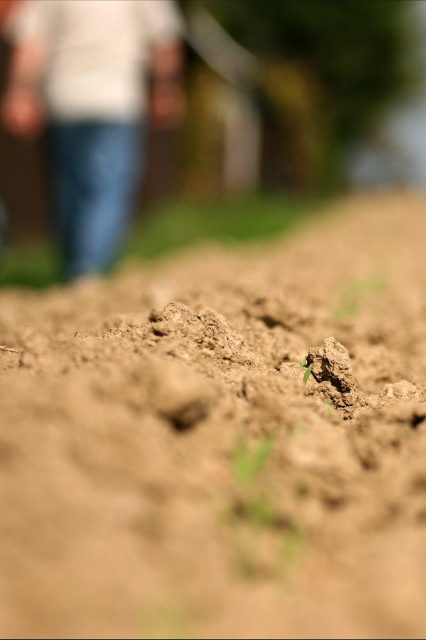
Question: Which of the following is the farthest from the observer?

Choices:
 (A) (101, 52)
 (B) (190, 586)

Answer: (A)

Question: Among these objects, which one is nearest to the camera?

Choices:
 (A) brown soil at center
 (B) denim jeans at left
 (C) green grass at center

Answer: (A)

Question: Is denim jeans at left behind green grass at center?

Choices:
 (A) no
 (B) yes

Answer: (B)

Question: Which object appears farthest from the camera in this image?

Choices:
 (A) brown soil at center
 (B) green grass at center

Answer: (B)

Question: Observing the image, what is the correct spatial positioning of denim jeans at left in reference to green grass at center?

Choices:
 (A) below
 (B) above

Answer: (B)

Question: Does brown soil at center have a greater width compared to denim jeans at left?

Choices:
 (A) yes
 (B) no

Answer: (B)